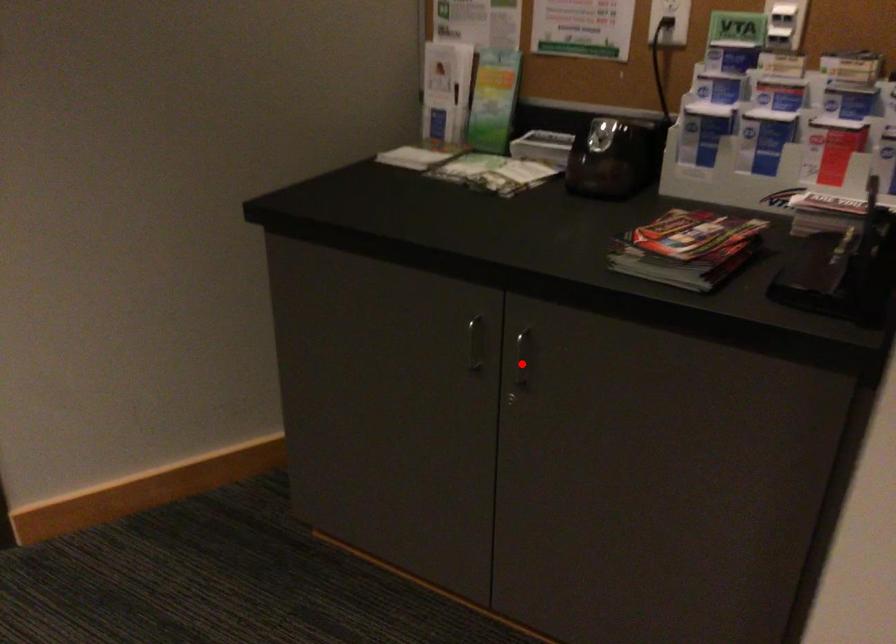
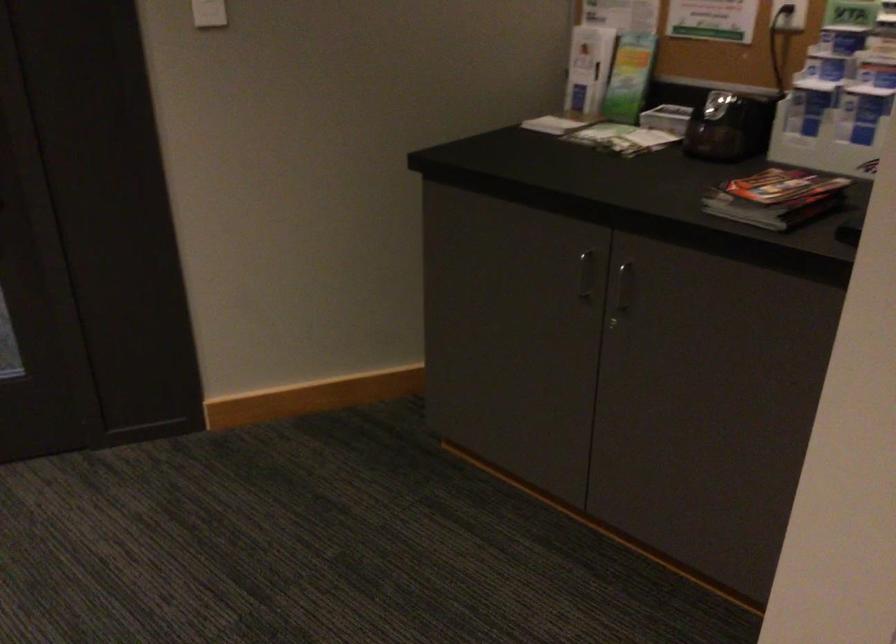
In the second image, find the point that corresponds to the highlighted location in the first image.

(622, 292)